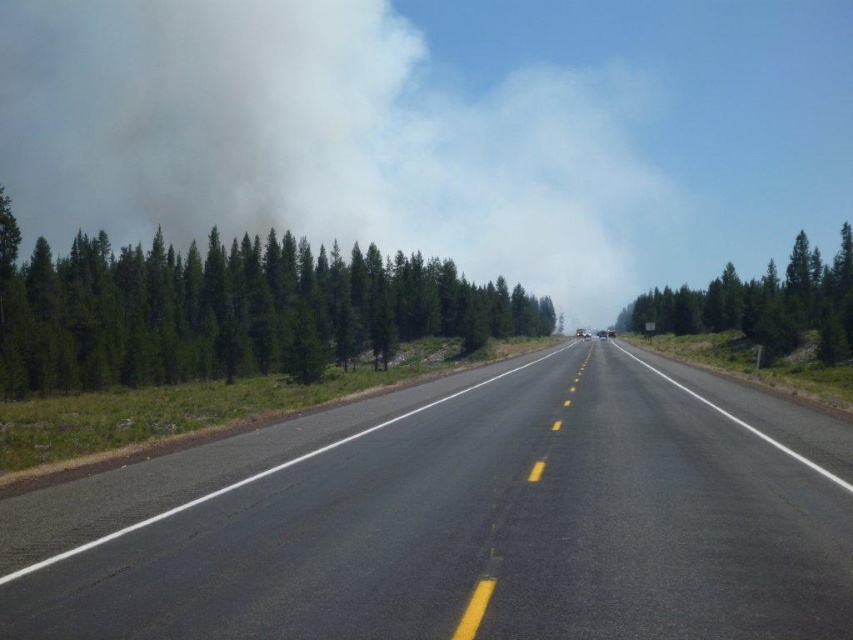
Question: Can you confirm if black asphalt highway at center is bigger than white smoke at upper center?

Choices:
 (A) yes
 (B) no

Answer: (B)

Question: Does white smoke at upper center appear under green textured trees at left?

Choices:
 (A) no
 (B) yes

Answer: (A)

Question: Can you confirm if white smoke at upper center is positioned below green textured tree at right?

Choices:
 (A) no
 (B) yes

Answer: (A)

Question: Among these objects, which one is farthest from the camera?

Choices:
 (A) green textured tree at right
 (B) white smoke at upper center
 (C) green textured trees at left

Answer: (B)

Question: Which of the following is the farthest from the observer?

Choices:
 (A) green textured trees at left
 (B) white smoke at upper center
 (C) green textured tree at right
 (D) black asphalt highway at center

Answer: (B)

Question: Which of the following is the closest to the observer?

Choices:
 (A) (242, 468)
 (B) (567, 136)
 (C) (788, 342)

Answer: (A)